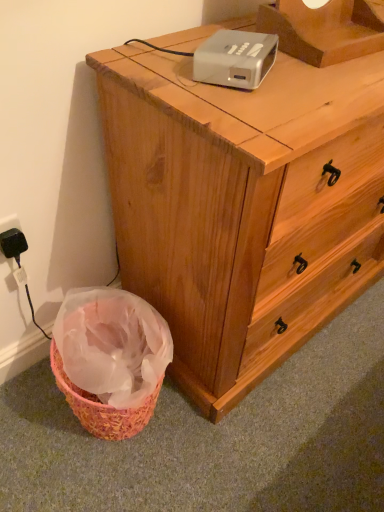
You are a GUI agent. You are given a task and a screenshot of the screen. Output one action in this format:
    pyautogui.click(x=<x>, y=<y>)
    Task: Click on the blank space to the left of white plastic projector at upper center
    
    Given the screenshot: What is the action you would take?
    pyautogui.click(x=154, y=62)